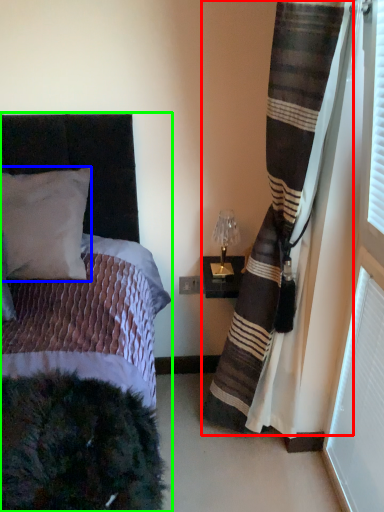
Question: Which object is the closest to the curtain (highlighted by a red box)? Choose among these: pillow (highlighted by a blue box) or bed (highlighted by a green box).

Choices:
 (A) pillow
 (B) bed

Answer: (B)